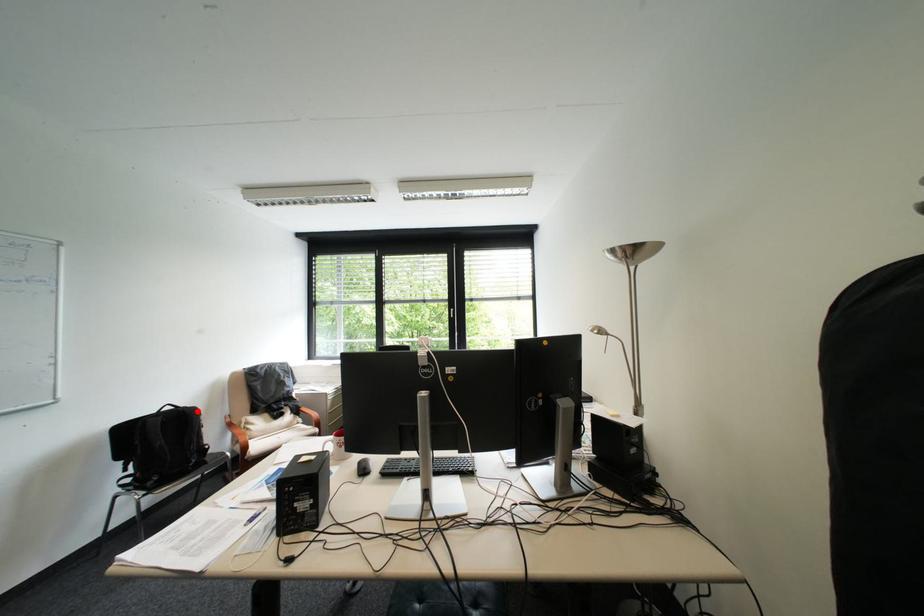
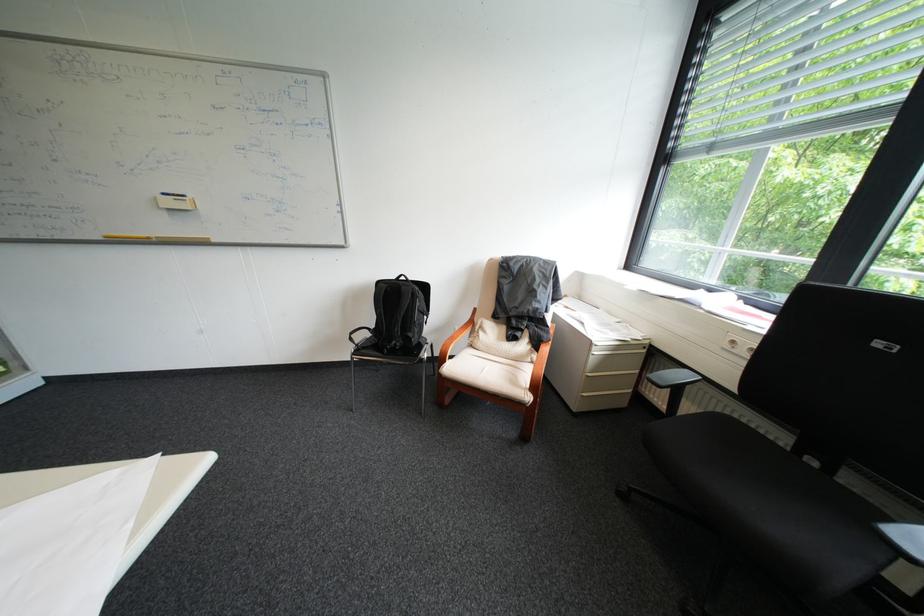
Where in the second image is the point corresponding to the highlighted location from the first image?

(415, 288)